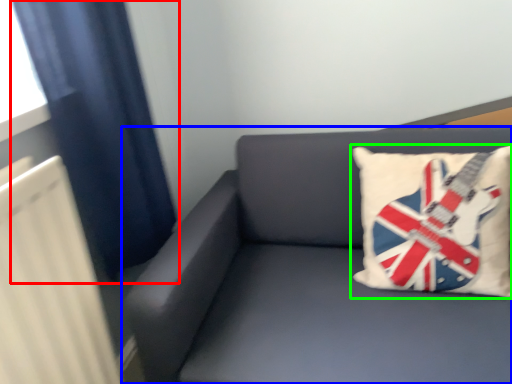
Question: Considering the real-world distances, which object is farthest from curtain (highlighted by a red box)? studio couch (highlighted by a blue box) or pillow (highlighted by a green box)?

Choices:
 (A) studio couch
 (B) pillow

Answer: (B)